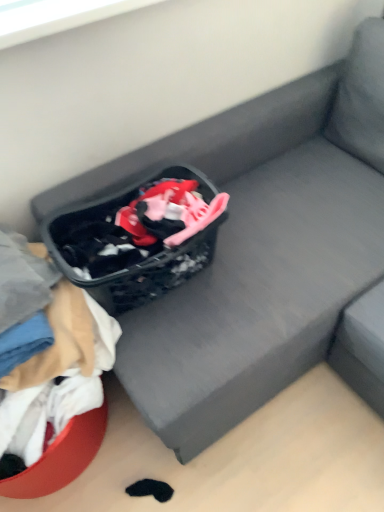
Question: Can you confirm if white cotton fabric at lower left is positioned to the right of black fabric shopping basket at center?

Choices:
 (A) yes
 (B) no

Answer: (B)

Question: Is white cotton fabric at lower left further to the viewer compared to black fabric shopping basket at center?

Choices:
 (A) yes
 (B) no

Answer: (B)

Question: Is white cotton fabric at lower left beside black fabric shopping basket at center?

Choices:
 (A) no
 (B) yes

Answer: (A)

Question: Can you confirm if white cotton fabric at lower left is taller than black fabric shopping basket at center?

Choices:
 (A) no
 (B) yes

Answer: (B)

Question: Is white cotton fabric at lower left at the left side of black fabric shopping basket at center?

Choices:
 (A) no
 (B) yes

Answer: (B)

Question: Is white cotton fabric at lower left thinner than black fabric shopping basket at center?

Choices:
 (A) no
 (B) yes

Answer: (A)

Question: Can you confirm if black fabric shopping basket at center is smaller than white cotton fabric at lower left?

Choices:
 (A) no
 (B) yes

Answer: (B)

Question: Is black fabric shopping basket at center not close to white cotton fabric at lower left?

Choices:
 (A) yes
 (B) no

Answer: (B)

Question: Considering the relative positions of black fabric shopping basket at center and white cotton fabric at lower left in the image provided, is black fabric shopping basket at center to the right of white cotton fabric at lower left from the viewer's perspective?

Choices:
 (A) yes
 (B) no

Answer: (A)

Question: Can you see black fabric shopping basket at center touching white cotton fabric at lower left?

Choices:
 (A) yes
 (B) no

Answer: (B)

Question: Is black fabric shopping basket at center aimed at white cotton fabric at lower left?

Choices:
 (A) yes
 (B) no

Answer: (B)

Question: Can white cotton fabric at lower left be found inside black fabric shopping basket at center?

Choices:
 (A) yes
 (B) no

Answer: (B)

Question: Is point (190, 180) closer or farther from the camera than point (99, 442)?

Choices:
 (A) farther
 (B) closer

Answer: (B)